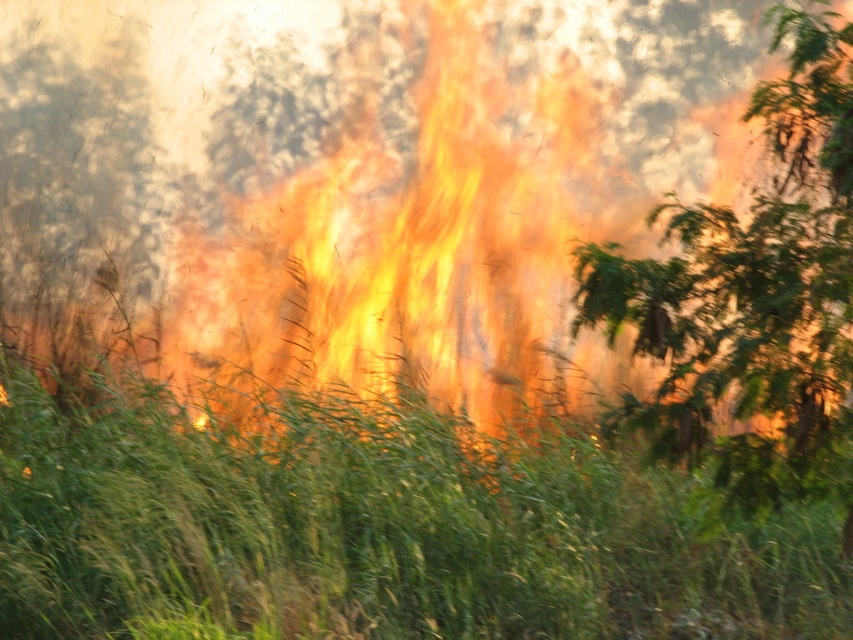
Question: Does flame-like at center have a greater width compared to green leafy tree at center?

Choices:
 (A) no
 (B) yes

Answer: (B)

Question: Estimate the real-world distances between objects in this image. Which object is closer to the flame-like at center?

Choices:
 (A) green leafy tree at left
 (B) green leafy tree at center

Answer: (A)

Question: Which of the following is the farthest from the observer?

Choices:
 (A) green leafy tree at left
 (B) green grass at center
 (C) green leafy tree at center

Answer: (A)

Question: Which point appears closest to the camera in this image?

Choices:
 (A) (318, 248)
 (B) (149, 241)

Answer: (B)

Question: Is flame-like at center to the right of green leafy tree at center from the viewer's perspective?

Choices:
 (A) yes
 (B) no

Answer: (B)

Question: Where is flame-like at center located in relation to green leafy tree at center in the image?

Choices:
 (A) left
 (B) right

Answer: (A)